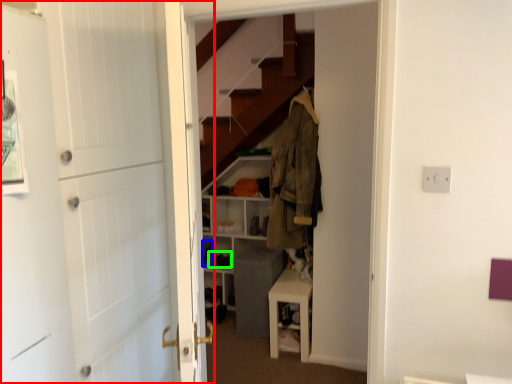
Question: Which object is the closest to the door (highlighted by a red box)? Choose among these: shoe (highlighted by a blue box) or shoe (highlighted by a green box).

Choices:
 (A) shoe
 (B) shoe

Answer: (A)